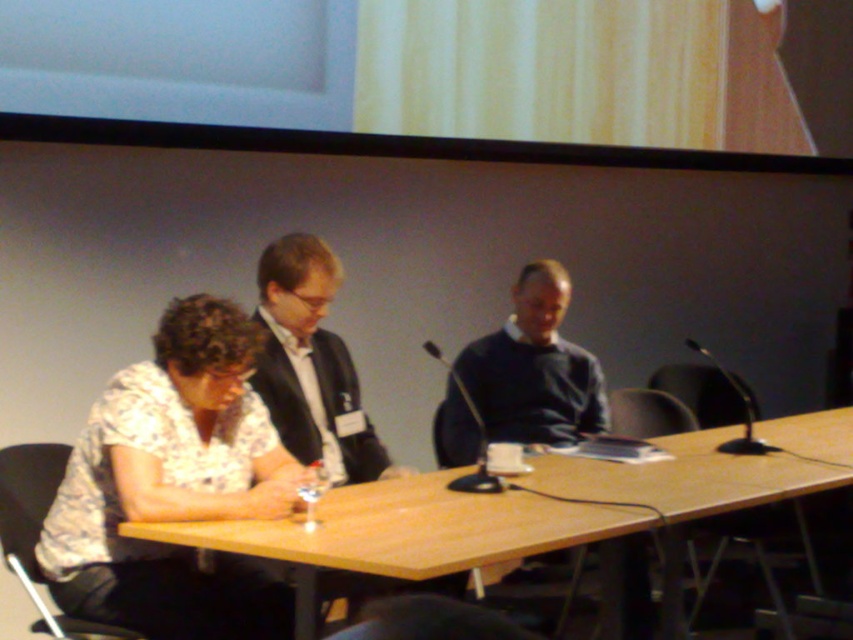
Question: Which of these objects is positioned farthest from the black plastic microphone at center?

Choices:
 (A) wooden table at lower left
 (B) white floral shirt at center

Answer: (B)

Question: Can you confirm if white floral shirt at center is positioned to the left of black plastic microphone at center?

Choices:
 (A) yes
 (B) no

Answer: (A)

Question: Among these objects, which one is nearest to the camera?

Choices:
 (A) dark blue sweater at center
 (B) white floral shirt at center
 (C) black plastic microphone at center

Answer: (B)

Question: Is white floral shirt at center above black plastic microphone at center?

Choices:
 (A) no
 (B) yes

Answer: (A)

Question: Which of the following is the farthest from the observer?

Choices:
 (A) white floral shirt at center
 (B) dark blue sweater at center
 (C) wooden table at lower left

Answer: (B)

Question: Is wooden table at lower left positioned before black plastic microphone at center?

Choices:
 (A) yes
 (B) no

Answer: (A)